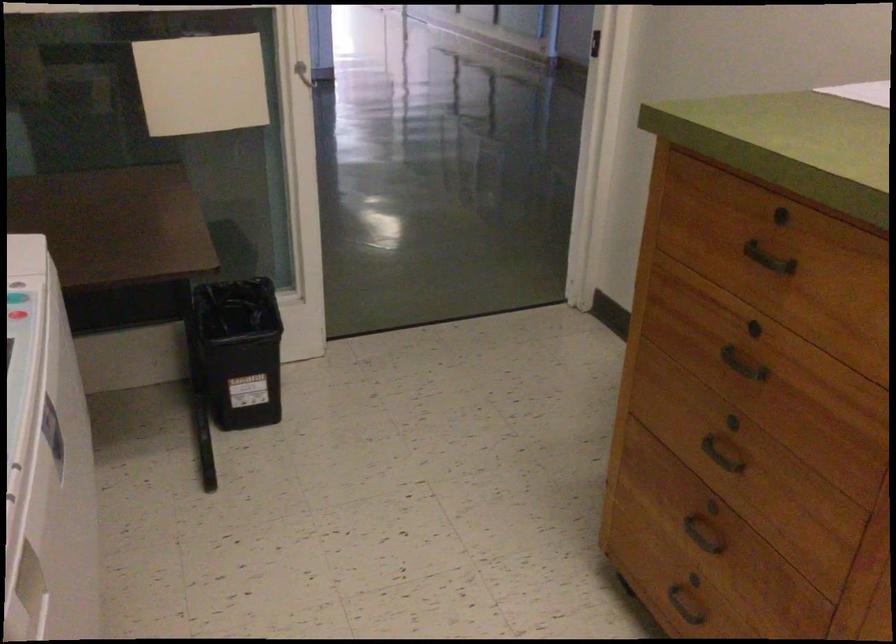
Find the location of `door handle`. door handle is located at coordinates (769, 260).